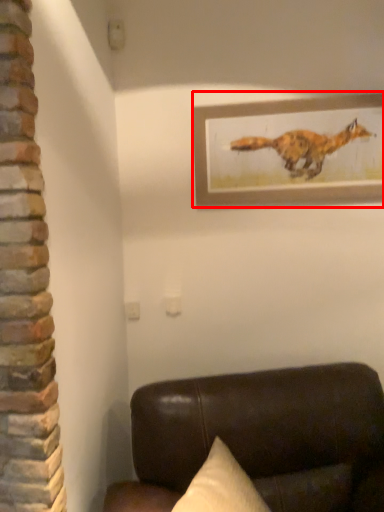
Question: From the image's perspective, considering the relative positions of picture frame (annotated by the red box) and furniture in the image provided, where is picture frame (annotated by the red box) located with respect to the staircase?

Choices:
 (A) below
 (B) above

Answer: (B)